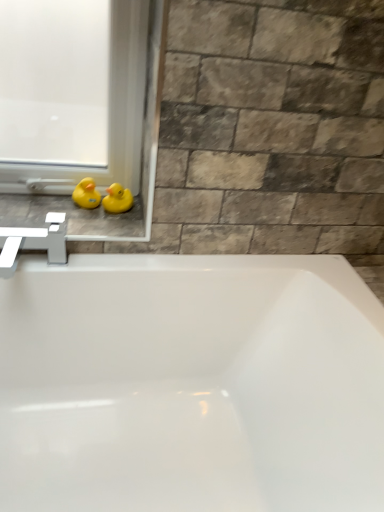
Where is `white plastic window frame at lower left`? The image size is (384, 512). white plastic window frame at lower left is located at coordinates (80, 110).

Image resolution: width=384 pixels, height=512 pixels. Describe the element at coordinates (80, 110) in the screenshot. I see `white plastic window frame at lower left` at that location.

The height and width of the screenshot is (512, 384). What do you see at coordinates (117, 199) in the screenshot?
I see `yellow rubber duck at upper left, the first duck positioned from the right` at bounding box center [117, 199].

This screenshot has width=384, height=512. What do you see at coordinates (76, 217) in the screenshot? I see `yellow rubber duck at left` at bounding box center [76, 217].

Find the location of a particular element. yellow rubber duck at left, which is the 2th duck in right-to-left order is located at coordinates (86, 194).

From the image's perspective, which one is positioned lower, yellow rubber duck at left, which is the 2th duck in right-to-left order, or yellow rubber duck at upper left, the 2th duck in the left-to-right sequence?

yellow rubber duck at upper left, the 2th duck in the left-to-right sequence, from the image's perspective.

Between yellow rubber duck at left, the 1th duck when ordered from left to right, and yellow rubber duck at upper left, the first duck positioned from the right, which one has smaller width?

yellow rubber duck at upper left, the first duck positioned from the right.

Where is `duck below the yellow rubber duck at left, the 1th duck when ordered from left to right (from the image's perspective)`? This screenshot has width=384, height=512. duck below the yellow rubber duck at left, the 1th duck when ordered from left to right (from the image's perspective) is located at coordinates (117, 199).

Which is farther from the camera, (85, 179) or (125, 190)?

The point (85, 179) is behind.

From the image's perspective, who appears lower, yellow rubber duck at upper left, the first duck positioned from the right, or white plastic window frame at lower left?

From the image's view, yellow rubber duck at upper left, the first duck positioned from the right, is below.

The width and height of the screenshot is (384, 512). Find the location of `window frame in front of the yellow rubber duck at upper left, the 2th duck in the left-to-right sequence`. window frame in front of the yellow rubber duck at upper left, the 2th duck in the left-to-right sequence is located at coordinates (80, 110).

How much distance is there between yellow rubber duck at upper left, the first duck positioned from the right, and white plastic window frame at lower left?

A distance of 9.79 inches exists between yellow rubber duck at upper left, the first duck positioned from the right, and white plastic window frame at lower left.

Can you confirm if yellow rubber duck at upper left, the 2th duck in the left-to-right sequence, is smaller than white plastic window frame at lower left?

Yes, yellow rubber duck at upper left, the 2th duck in the left-to-right sequence, is smaller than white plastic window frame at lower left.

In the scene shown: Considering the positions of objects yellow rubber duck at left, which is the 2th duck in right-to-left order, and yellow rubber duck at left in the image provided, who is more to the left, yellow rubber duck at left, which is the 2th duck in right-to-left order, or yellow rubber duck at left?

yellow rubber duck at left is more to the left.

In terms of width, does yellow rubber duck at left, which is the 2th duck in right-to-left order, look wider or thinner when compared to yellow rubber duck at left?

Considering their sizes, yellow rubber duck at left, which is the 2th duck in right-to-left order, looks slimmer than yellow rubber duck at left.

Is yellow rubber duck at left, which is the 2th duck in right-to-left order, facing away from yellow rubber duck at left?

yellow rubber duck at left, which is the 2th duck in right-to-left order, does not have its back to yellow rubber duck at left.

This screenshot has height=512, width=384. In the image, there is a yellow rubber duck at left, the 1th duck when ordered from left to right. Find the location of `window sill below it (from the image's perspective)`. window sill below it (from the image's perspective) is located at coordinates (76, 217).

In the scene shown: Which object is positioned more to the left, yellow rubber duck at left or yellow rubber duck at left, which is the 2th duck in right-to-left order?

From the viewer's perspective, yellow rubber duck at left appears more on the left side.

Would you consider yellow rubber duck at left to be distant from yellow rubber duck at left, the 1th duck when ordered from left to right?

No, yellow rubber duck at left is in close proximity to yellow rubber duck at left, the 1th duck when ordered from left to right.

Could you measure the distance between white plastic window frame at lower left and yellow rubber duck at upper left, the first duck positioned from the right?

They are 9.79 inches apart.

From the image's perspective, which one is positioned lower, white plastic window frame at lower left or yellow rubber duck at upper left, the 2th duck in the left-to-right sequence?

yellow rubber duck at upper left, the 2th duck in the left-to-right sequence, is shown below in the image.

At what (x,y) coordinates should I click in order to perform the action: click on window frame located in front of the yellow rubber duck at upper left, the 2th duck in the left-to-right sequence. Please return your answer as a coordinate pair (x, y). This screenshot has height=512, width=384. Looking at the image, I should click on (80, 110).

Does point (143, 201) lie in front of point (85, 207)?

No.

Considering the sizes of objects white plastic window frame at lower left and yellow rubber duck at left, the 1th duck when ordered from left to right, in the image provided, who is bigger, white plastic window frame at lower left or yellow rubber duck at left, the 1th duck when ordered from left to right,?

white plastic window frame at lower left is bigger.

Considering the relative sizes of white plastic window frame at lower left and yellow rubber duck at left, which is the 2th duck in right-to-left order, in the image provided, is white plastic window frame at lower left wider than yellow rubber duck at left, which is the 2th duck in right-to-left order,?

Yes, white plastic window frame at lower left is wider than yellow rubber duck at left, which is the 2th duck in right-to-left order.

In the scene shown: From a real-world perspective, between white plastic window frame at lower left and yellow rubber duck at left, which is the 2th duck in right-to-left order, who is vertically higher?

white plastic window frame at lower left, from a real-world perspective.

Where is `window sill behind the white plastic window frame at lower left`? The image size is (384, 512). window sill behind the white plastic window frame at lower left is located at coordinates (76, 217).

Between white plastic window frame at lower left and yellow rubber duck at left, which one has larger size?

With larger size is white plastic window frame at lower left.

Which point is more distant from viewer, (135, 95) or (129, 213)?

The point (129, 213) is farther from the camera.

Locate an element on the screen. This screenshot has height=512, width=384. duck in front of the yellow rubber duck at left, which is the 2th duck in right-to-left order is located at coordinates (117, 199).

The height and width of the screenshot is (512, 384). Find the location of `the 1st duck below the white plastic window frame at lower left (from a real-world perspective)`. the 1st duck below the white plastic window frame at lower left (from a real-world perspective) is located at coordinates (117, 199).

Based on their spatial positions, is white plastic window frame at lower left or yellow rubber duck at left, the 1th duck when ordered from left to right, further from yellow rubber duck at left?

The object further to yellow rubber duck at left is white plastic window frame at lower left.

Looking at the image, which one is located closer to yellow rubber duck at left, the 1th duck when ordered from left to right, white plastic window frame at lower left or yellow rubber duck at left?

yellow rubber duck at left is positioned closer to the anchor yellow rubber duck at left, the 1th duck when ordered from left to right.

Looking at the image, which one is located closer to white plastic window frame at lower left, yellow rubber duck at upper left, the first duck positioned from the right, or yellow rubber duck at left, which is the 2th duck in right-to-left order?

yellow rubber duck at left, which is the 2th duck in right-to-left order, lies closer to white plastic window frame at lower left than the other object.

Based on the photo, from the image, which object appears to be nearer to yellow rubber duck at left, white plastic window frame at lower left or yellow rubber duck at upper left, the 2th duck in the left-to-right sequence?

yellow rubber duck at upper left, the 2th duck in the left-to-right sequence, is positioned closer to the anchor yellow rubber duck at left.

From the image, which object appears to be farther from yellow rubber duck at upper left, the first duck positioned from the right, yellow rubber duck at left or yellow rubber duck at left, which is the 2th duck in right-to-left order?

The object further to yellow rubber duck at upper left, the first duck positioned from the right, is yellow rubber duck at left.

In the scene shown: From the image, which object appears to be nearer to yellow rubber duck at left, yellow rubber duck at left, the 1th duck when ordered from left to right, or yellow rubber duck at upper left, the first duck positioned from the right?

yellow rubber duck at left, the 1th duck when ordered from left to right.

Considering their positions, is yellow rubber duck at left positioned closer to yellow rubber duck at upper left, the 2th duck in the left-to-right sequence, than white plastic window frame at lower left?

The object closer to yellow rubber duck at upper left, the 2th duck in the left-to-right sequence, is yellow rubber duck at left.

Considering their positions, is yellow rubber duck at left, which is the 2th duck in right-to-left order, positioned further to white plastic window frame at lower left than yellow rubber duck at upper left, the 2th duck in the left-to-right sequence?

Among the two, yellow rubber duck at upper left, the 2th duck in the left-to-right sequence, is located further to white plastic window frame at lower left.

At what (x,y) coordinates should I click in order to perform the action: click on duck located between white plastic window frame at lower left and yellow rubber duck at left, the 1th duck when ordered from left to right, in the depth direction. Please return your answer as a coordinate pair (x, y). This screenshot has height=512, width=384. Looking at the image, I should click on (117, 199).

Identify the location of duck situated between yellow rubber duck at left and yellow rubber duck at upper left, the first duck positioned from the right, from left to right. The height and width of the screenshot is (512, 384). (86, 194).